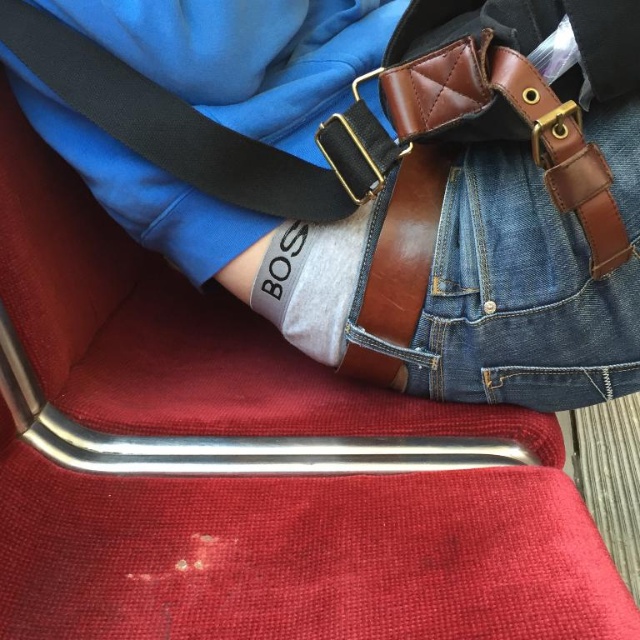
Measure the distance between brown leather bag at center and camera.

brown leather bag at center and camera are 26.91 inches apart from each other.

Based on the photo, can you confirm if brown leather bag at center is positioned below denim at center?

No, brown leather bag at center is not below denim at center.

Is point (132, 13) farther from camera compared to point (422, 365)?

No, it is in front of (422, 365).

This screenshot has height=640, width=640. I want to click on brown leather bag at center, so click(x=371, y=173).